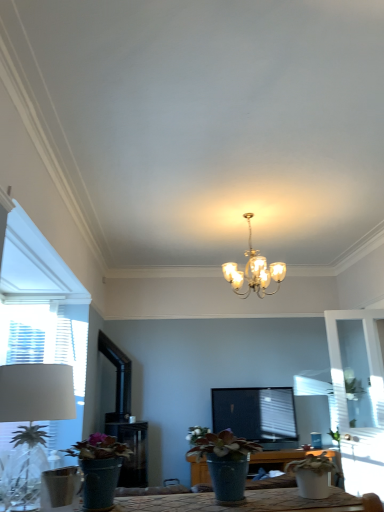
Question: From the image's perspective, is white matte pot at lower right, which is the 1th houseplant in right-to-left order, positioned above or below white fabric lampshade at left?

Choices:
 (A) below
 (B) above

Answer: (A)

Question: From a real-world perspective, is white matte pot at lower right, which is the 1th houseplant in right-to-left order, above or below white fabric lampshade at left?

Choices:
 (A) below
 (B) above

Answer: (A)

Question: Which is nearer to the transparent glass door at right?

Choices:
 (A) matte green pot at lower left, which is the first houseplant from left to right
 (B) gold metallic chandelier at center
 (C) white fabric lampshade at left
 (D) white matte flower at center
 (E) white matte pot at lower right, which is the 1th houseplant in right-to-left order

Answer: (B)

Question: Which object is the closest to the matte green pot at lower left, which is the first houseplant from left to right?

Choices:
 (A) matte blue pot at center, the 2th houseplant positioned from the left
 (B) white matte pot at lower right, which is the 3th houseplant in left-to-right order
 (C) transparent glass door at right
 (D) gold metallic chandelier at center
 (E) white fabric lampshade at left

Answer: (E)